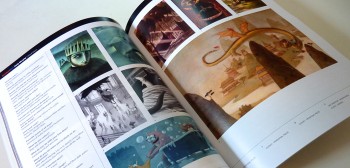
Image resolution: width=350 pixels, height=168 pixels. In order to click on space between side by side pictures in this screenshot , I will do `click(181, 14)`, `click(221, 2)`, `click(99, 45)`, `click(133, 94)`.